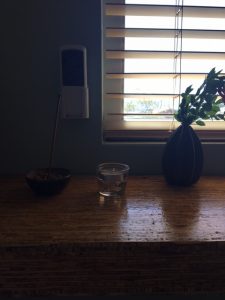
Where is `clear cup`? This screenshot has height=300, width=225. clear cup is located at coordinates coord(110,180).